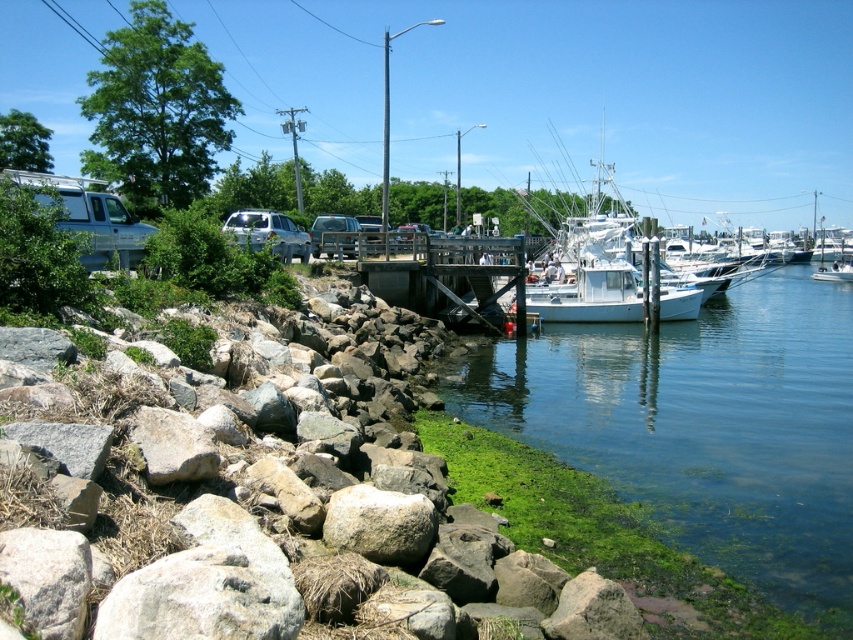
Is white matte boat at center smaller than gray rough rock at lower left?

Actually, white matte boat at center might be larger than gray rough rock at lower left.

Looking at this image, who is lower down, white matte boat at center or gray rough rock at lower left?

Positioned lower is gray rough rock at lower left.

Where is `white matte boat at center`? white matte boat at center is located at coordinates (608, 275).

Is green algae-covered water at lower right thinner than white matte van at left?

In fact, green algae-covered water at lower right might be wider than white matte van at left.

Based on the photo, who is positioned more to the left, green algae-covered water at lower right or white matte van at left?

white matte van at left

What do you see at coordinates (705, 428) in the screenshot? This screenshot has width=853, height=640. I see `green algae-covered water at lower right` at bounding box center [705, 428].

This screenshot has width=853, height=640. I want to click on green algae-covered water at lower right, so click(x=705, y=428).

Is point (57, 224) closer to camera compared to point (172, 477)?

No.

Which is below, white matte van at left or gray rough rock at lower left?

gray rough rock at lower left is below.

Find the location of a particular element. The width and height of the screenshot is (853, 640). white matte van at left is located at coordinates click(x=90, y=216).

Locate an element on the screen. The height and width of the screenshot is (640, 853). white matte van at left is located at coordinates (90, 216).